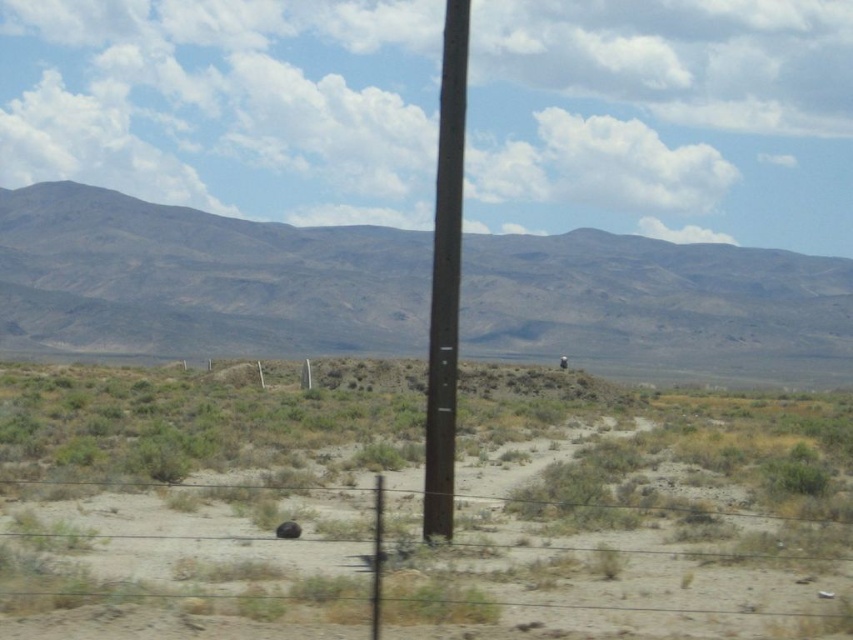
Is point (180, 470) closer to viewer compared to point (456, 244)?

That is False.

Between brown sandy dirt at center and brown wooden pole at center, which one is positioned higher?

brown wooden pole at center is higher up.

Locate an element on the screen. This screenshot has height=640, width=853. brown sandy dirt at center is located at coordinates (416, 506).

Based on the photo, is gray/desert-textured mountain at upper center to the right of brown wooden pole at center from the viewer's perspective?

Correct, you'll find gray/desert-textured mountain at upper center to the right of brown wooden pole at center.

Can you confirm if gray/desert-textured mountain at upper center is positioned below brown wooden pole at center?

Incorrect, gray/desert-textured mountain at upper center is not positioned below brown wooden pole at center.

What do you see at coordinates (201, 276) in the screenshot? I see `gray/desert-textured mountain at upper center` at bounding box center [201, 276].

The image size is (853, 640). Find the location of `gray/desert-textured mountain at upper center`. gray/desert-textured mountain at upper center is located at coordinates (201, 276).

Is brown sandy dirt at center above gray/desert-textured mountain at upper center?

Actually, brown sandy dirt at center is below gray/desert-textured mountain at upper center.

Does point (277, 605) lie behind point (263, 332)?

No, it is in front of (263, 332).

The height and width of the screenshot is (640, 853). Identify the location of brown sandy dirt at center. (416, 506).